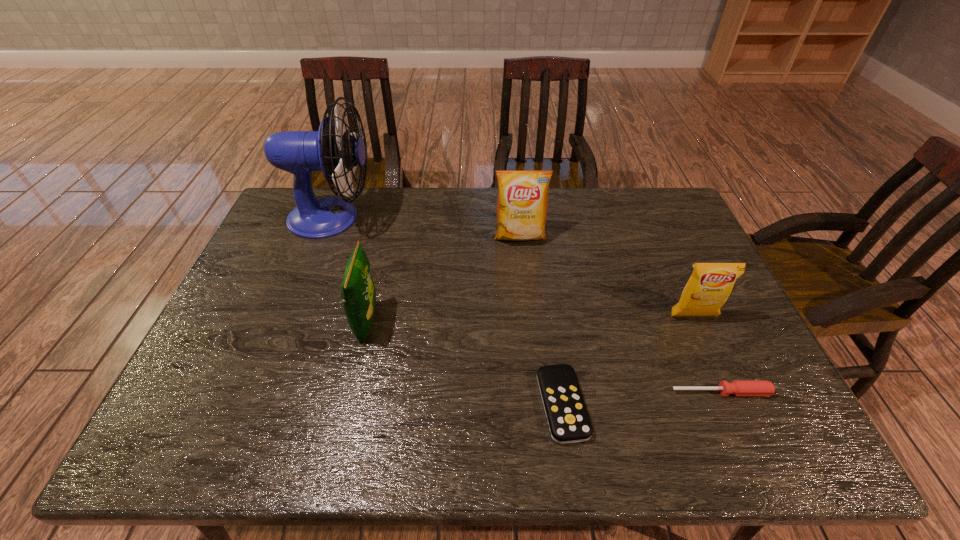
I want to click on free space at the far edge of the desktop, so click(x=371, y=226).

Image resolution: width=960 pixels, height=540 pixels. I want to click on vacant space at the near edge, so click(x=720, y=438).

This screenshot has height=540, width=960. What are the coordinates of `vacant space at the left edge` in the screenshot? It's located at (186, 382).

Find the location of `vacant area at the right edge of the desktop`. vacant area at the right edge of the desktop is located at coordinates (x=695, y=247).

The height and width of the screenshot is (540, 960). Find the location of `free spot between the screwdriver and the leftmost object`. free spot between the screwdriver and the leftmost object is located at coordinates (526, 305).

Locate an element on the screen. The image size is (960, 540). unoccupied position between the rightmost crisp (potato chip) and the remote control is located at coordinates (628, 361).

At what (x,y) coordinates should I click in order to perform the action: click on vacant area that lies between the tallest object and the rightmost crisp (potato chip). Please return your answer as a coordinate pair (x, y). The width and height of the screenshot is (960, 540). Looking at the image, I should click on (513, 267).

The image size is (960, 540). Find the location of `vacant area that lies between the remote control and the leftmost object`. vacant area that lies between the remote control and the leftmost object is located at coordinates 447,311.

Identify the location of free space that is in between the remote control and the leftmost object. This screenshot has height=540, width=960. [x=447, y=311].

What are the coordinates of `vacant space that's between the leftmost object and the farthest crisp (potato chip)` in the screenshot? It's located at (426, 227).